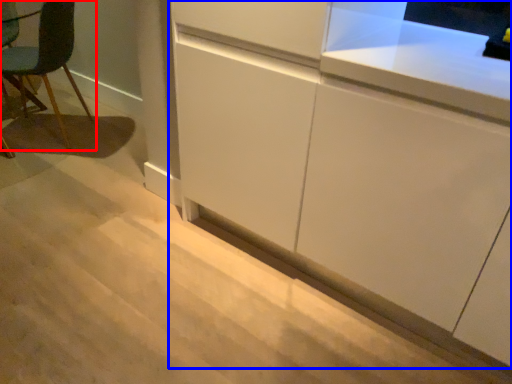
Question: Among these objects, which one is nearest to the camera, chair (highlighted by a red box) or cabinetry (highlighted by a blue box)?

Choices:
 (A) chair
 (B) cabinetry

Answer: (B)